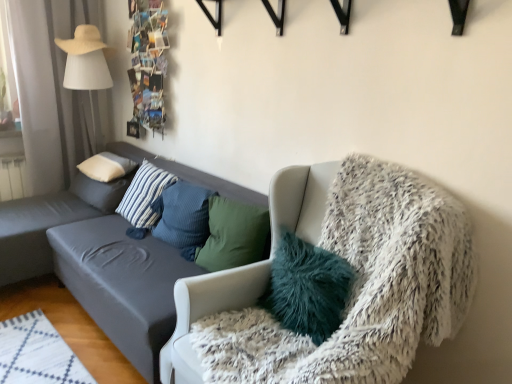
Question: Considering the positions of blue textured pillow at center, the second pillow when ordered from right to left, and white soft pillow at upper left, the 1th pillow when ordered from left to right, in the image, is blue textured pillow at center, the second pillow when ordered from right to left, wider or thinner than white soft pillow at upper left, the 1th pillow when ordered from left to right,?

Choices:
 (A) thin
 (B) wide

Answer: (A)

Question: From a real-world perspective, is blue textured pillow at center, which appears as the fourth pillow when viewed from the left, positioned above or below white soft pillow at upper left, the 1th pillow when ordered from left to right?

Choices:
 (A) above
 (B) below

Answer: (A)

Question: Which object is the closest to the dark gray fabric couch at left?

Choices:
 (A) white soft pillow at upper left, arranged as the fifth pillow when viewed from the right
 (B) white soft pillow at left, acting as the fourth pillow starting from the right
 (C) white fluffy chair at right
 (D) white fabric lampshade at left
 (E) teal fluffy pillow at center, the 1th pillow when ordered from right to left

Answer: (A)

Question: Which object is positioned farthest from the blue striped pillow at center, the third pillow viewed from the left?

Choices:
 (A) white soft pillow at upper left, arranged as the fifth pillow when viewed from the right
 (B) white fluffy chair at right
 (C) teal fluffy pillow at center, the 1th pillow when ordered from right to left
 (D) white soft pillow at left, which is the 2th pillow from left to right
 (E) white fabric lampshade at left

Answer: (B)